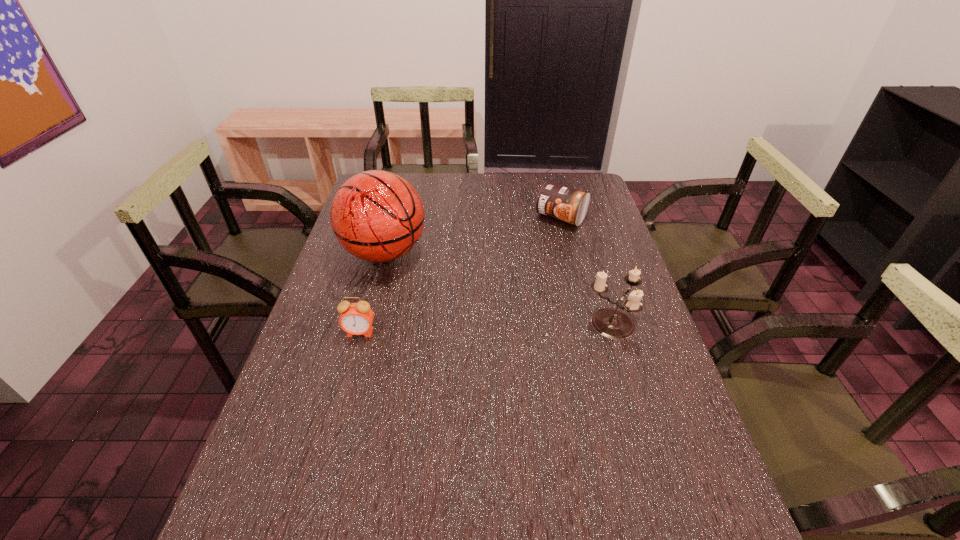
This screenshot has height=540, width=960. What are the coordinates of `vacant space positioned on the front label of the can` in the screenshot? It's located at (527, 254).

Find the location of a particular element. vacant space located 0.350m on the front label of the can is located at coordinates (496, 287).

Locate an element on the screen. The width and height of the screenshot is (960, 540). object that is at the far edge is located at coordinates [x=560, y=202].

Locate an element on the screen. alarm clock that is positioned at the left edge is located at coordinates (356, 318).

Locate an element on the screen. The height and width of the screenshot is (540, 960). basketball at the left edge is located at coordinates (377, 216).

Identify the location of candle holder that is at the right edge. (612, 323).

Identify the location of can located in the right edge section of the desktop. (560, 202).

Locate an element on the screen. This screenshot has height=540, width=960. object located at the far right corner is located at coordinates (560, 202).

Find the location of a particular element. vacant position at the far edge of the desktop is located at coordinates (538, 185).

In the image, there is a desktop. Where is `free space at the left edge`? The width and height of the screenshot is (960, 540). free space at the left edge is located at coordinates (331, 326).